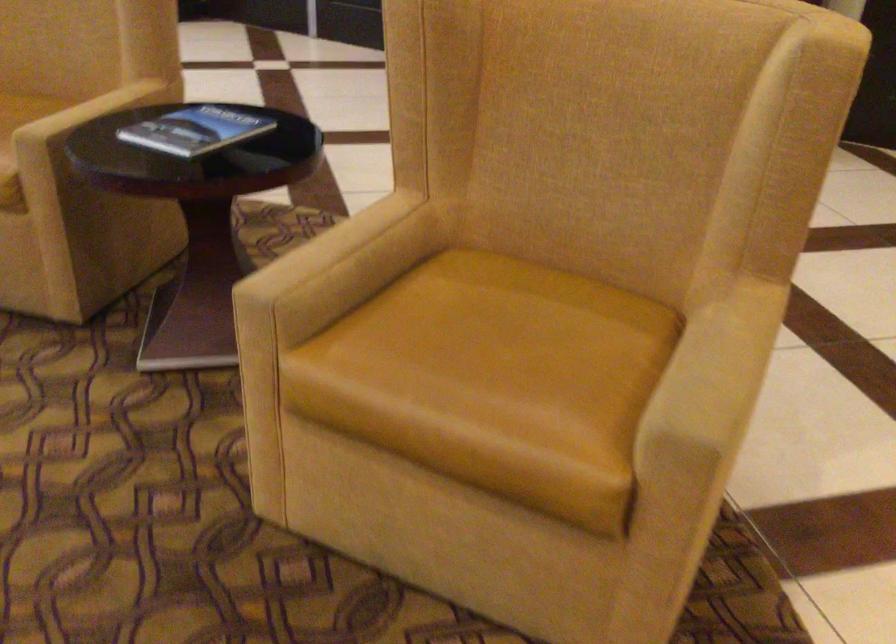
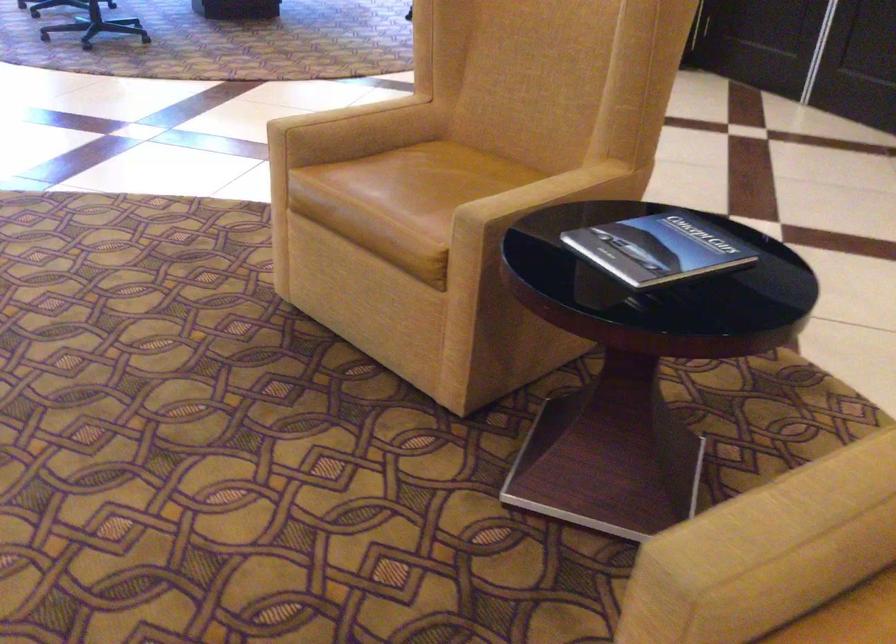
Find the pixel in the second image that matches pixel 90 104 in the first image.

(541, 193)